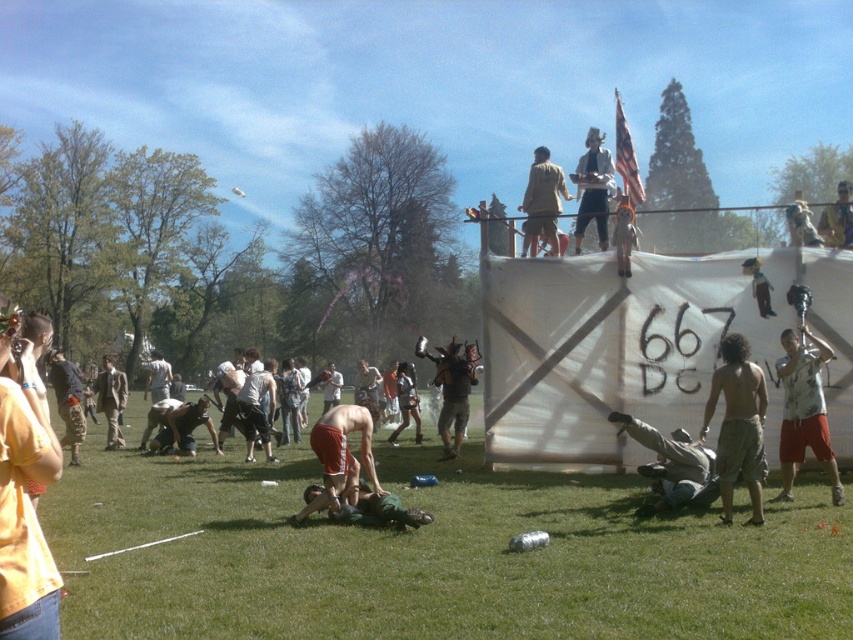
Is point (795, 420) closer to camera compared to point (328, 502)?

No, (795, 420) is further to viewer.

Can you confirm if light green fabric shirt at right is taller than orange shorts at center?

Yes, light green fabric shirt at right is taller than orange shorts at center.

Is point (804, 422) in front of point (347, 481)?

No, it is not.

Identify the location of light green fabric shirt at right. The image size is (853, 640). (804, 410).

What do you see at coordinates (430, 556) in the screenshot? I see `green grass at lower center` at bounding box center [430, 556].

Is point (450, 497) more distant than point (744, 433)?

That is True.

This screenshot has height=640, width=853. I want to click on green grass at lower center, so click(430, 556).

In the scene shown: Can you confirm if camouflage fabric person at lower center is positioned below light brown leather jacket at upper center?

Yes, camouflage fabric person at lower center is below light brown leather jacket at upper center.

Who is lower down, camouflage fabric person at lower center or light brown leather jacket at upper center?

camouflage fabric person at lower center is lower down.

Between point (664, 468) and point (595, 220), which one is positioned behind?

Point (595, 220)

You are a GUI agent. You are given a task and a screenshot of the screen. Output one action in this format:
    pyautogui.click(x=<x>, y=<y>)
    Task: Click on the camouflage fabric person at lower center
    The width and height of the screenshot is (853, 640).
    Given the screenshot: What is the action you would take?
    pyautogui.click(x=671, y=467)